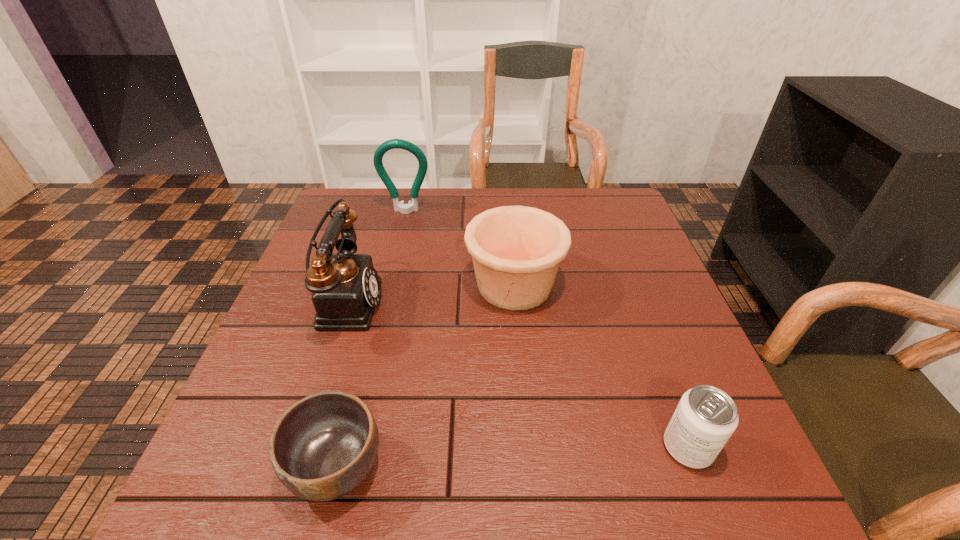
Where is `vacant space that is in between the farthest object and the soda can`? The width and height of the screenshot is (960, 540). vacant space that is in between the farthest object and the soda can is located at coordinates (547, 329).

Find the location of a particular element. This screenshot has height=540, width=960. vacant space that's between the soda can and the farthest object is located at coordinates (547, 329).

Find the location of `empty space between the soda can and the telephone`. empty space between the soda can and the telephone is located at coordinates (516, 374).

The width and height of the screenshot is (960, 540). Identify the location of blank region between the second shortest object and the pottery. (601, 366).

Image resolution: width=960 pixels, height=540 pixels. What are the coordinates of `free point between the telephone and the farthest object` in the screenshot? It's located at (375, 256).

Where is `empty space between the farthest object and the pottery`? This screenshot has height=540, width=960. empty space between the farthest object and the pottery is located at coordinates (460, 248).

This screenshot has height=540, width=960. I want to click on unoccupied position between the bottle opener and the bowl, so click(372, 339).

You are a GUI agent. You are given a task and a screenshot of the screen. Output one action in this format:
    pyautogui.click(x=<x>, y=<y>)
    Task: Click on the object identified as the closest to the bowl
    
    Given the screenshot: What is the action you would take?
    pyautogui.click(x=346, y=286)

Locate an element on the screen. the second closest object to the pottery is located at coordinates (412, 205).

Image resolution: width=960 pixels, height=540 pixels. Identify the location of free space that satisfies the following two spatial constraints: 1. on the front of the telephone at the rotary dial; 2. on the left side of the fourth tallest object. (296, 448).